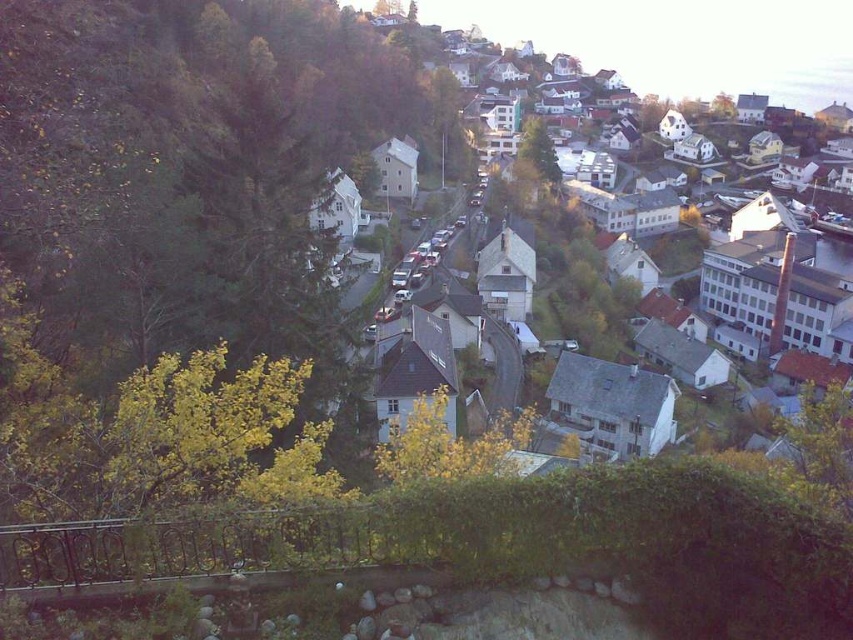
From the picture: Can you confirm if white matte houses at upper center is taller than green leafy tree at center?

Indeed, white matte houses at upper center has a greater height compared to green leafy tree at center.

Where is `white matte houses at upper center`? The image size is (853, 640). white matte houses at upper center is located at coordinates 682,40.